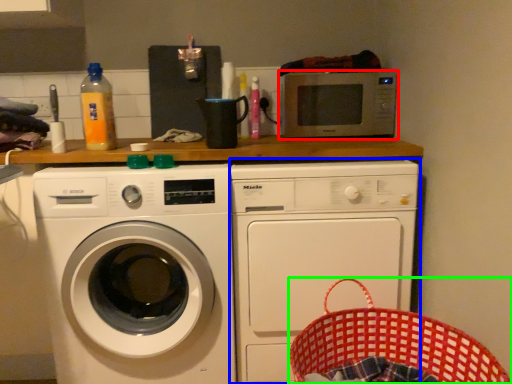
Question: Which object is the farthest from microwave oven (highlighted by a red box)? Choose among these: washing machine (highlighted by a blue box) or basket (highlighted by a green box).

Choices:
 (A) washing machine
 (B) basket

Answer: (B)